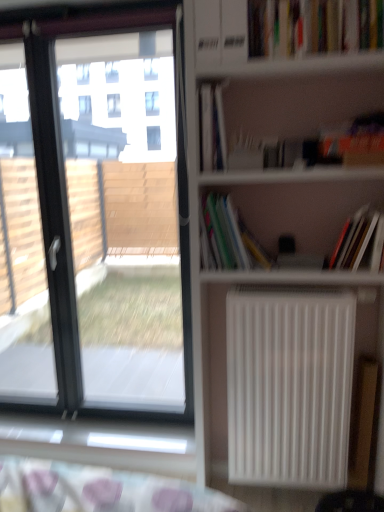
The image size is (384, 512). Describe the element at coordinates (95, 217) in the screenshot. I see `transparent glass window at left` at that location.

Describe the element at coordinates (354, 240) in the screenshot. I see `hardcover book at right, which appears as the fourth book when viewed from the top` at that location.

What do you see at coordinates (212, 128) in the screenshot? Image resolution: width=384 pixels, height=512 pixels. I see `hardcover book at upper center, marked as the 3th book in a bottom-to-top arrangement` at bounding box center [212, 128].

Where is `multicolored paper at center, which is the 3th book in top-to-bottom order`? multicolored paper at center, which is the 3th book in top-to-bottom order is located at coordinates (227, 237).

Find the location of `white matte radiator at center right`. white matte radiator at center right is located at coordinates (289, 386).

Where is `bookcase on the left of white matte radiator at center right`? bookcase on the left of white matte radiator at center right is located at coordinates (265, 272).

Which point is more distant from viewer, (353, 312) or (340, 85)?

Positioned behind is point (340, 85).

From a real-world perspective, which is physically above, white matte radiator at center right or white matte radiator at center?

In real-world perspective, white matte radiator at center is above.

Would you say white matte radiator at center right is outside white matte radiator at center?

No, most part of white matte radiator at center right lies within white matte radiator at center.

Based on their positions, is hardcover book at upper center, marked as the 3th book in a bottom-to-top arrangement, located to the left or right of multicolored paper at center, which is the 3th book in top-to-bottom order?

Clearly, hardcover book at upper center, marked as the 3th book in a bottom-to-top arrangement, is on the left of multicolored paper at center, which is the 3th book in top-to-bottom order, in the image.

Relative to multicolored paper at center, which is the 3th book in top-to-bottom order, is hardcover book at upper center, marked as the 3th book in a bottom-to-top arrangement, in front or behind?

Clearly, hardcover book at upper center, marked as the 3th book in a bottom-to-top arrangement, is in front of multicolored paper at center, which is the 3th book in top-to-bottom order.

Which of these two, hardcover book at upper center, marked as the 3th book in a bottom-to-top arrangement, or multicolored paper at center, which is the 2th book in bottom-to-top order, stands taller?

hardcover book at upper center, marked as the 3th book in a bottom-to-top arrangement.

Considering their positions, is multicolored paper at center, which is the 3th book in top-to-bottom order, located in front of or behind white matte radiator at center?

multicolored paper at center, which is the 3th book in top-to-bottom order, is behind white matte radiator at center.

Between multicolored paper at center, which is the 2th book in bottom-to-top order, and white matte radiator at center, which one appears on the left side from the viewer's perspective?

From the viewer's perspective, multicolored paper at center, which is the 2th book in bottom-to-top order, appears more on the left side.

From the image's perspective, which object appears higher, multicolored paper at center, which is the 2th book in bottom-to-top order, or white matte radiator at center?

multicolored paper at center, which is the 2th book in bottom-to-top order.

Is the surface of multicolored paper at center, which is the 3th book in top-to-bottom order, in direct contact with white matte radiator at center?

multicolored paper at center, which is the 3th book in top-to-bottom order, and white matte radiator at center are not in contact.

From the picture: Is transparent glass window at left positioned with its back to white matte radiator at center?

No, white matte radiator at center is not at the back of transparent glass window at left.

From a real-world perspective, which object stands above the other?

From a 3D spatial view, transparent glass window at left is above.

The height and width of the screenshot is (512, 384). Identify the location of window behind the white matte radiator at center. (95, 217).

Looking at their sizes, would you say transparent glass window at left is wider or thinner than white matte radiator at center?

Clearly, transparent glass window at left has less width compared to white matte radiator at center.

Measure the distance between white matte radiator at center and hardcover book at right, the first book in the bottom-to-top sequence.

The distance of white matte radiator at center from hardcover book at right, the first book in the bottom-to-top sequence, is 15.34 inches.

Which object is thinner, white matte radiator at center or hardcover book at right, which appears as the fourth book when viewed from the top?

hardcover book at right, which appears as the fourth book when viewed from the top, is thinner.

From the image's perspective, which object appears higher, white matte radiator at center or hardcover book at right, which appears as the fourth book when viewed from the top?

hardcover book at right, which appears as the fourth book when viewed from the top, from the image's perspective.

Is white matte radiator at center taller than hardcover book at right, the first book in the bottom-to-top sequence?

Indeed, white matte radiator at center has a greater height compared to hardcover book at right, the first book in the bottom-to-top sequence.

Between hardcover book at upper center, marked as the 3th book in a bottom-to-top arrangement, and hardcover book at upper right, the 4th book in the bottom-to-top sequence, which one appears on the left side from the viewer's perspective?

From the viewer's perspective, hardcover book at upper center, marked as the 3th book in a bottom-to-top arrangement, appears more on the left side.

How different are the orientations of hardcover book at upper center, marked as the 3th book in a bottom-to-top arrangement, and hardcover book at upper right, the 4th book in the bottom-to-top sequence, in degrees?

The facing directions of hardcover book at upper center, marked as the 3th book in a bottom-to-top arrangement, and hardcover book at upper right, the 4th book in the bottom-to-top sequence, are 0.977 degrees apart.

Who is shorter, hardcover book at upper center, which ranks as the second book in top-to-bottom order, or hardcover book at upper right, the 4th book in the bottom-to-top sequence?

With less height is hardcover book at upper right, the 4th book in the bottom-to-top sequence.

Is hardcover book at upper center, which ranks as the second book in top-to-bottom order, positioned with its back to hardcover book at upper right, the 4th book in the bottom-to-top sequence?

No, hardcover book at upper center, which ranks as the second book in top-to-bottom order, is not facing the opposite direction of hardcover book at upper right, the 4th book in the bottom-to-top sequence.

Which is more to the right, hardcover book at upper right, which is the 1th book from top to bottom, or transparent glass window at left?

From the viewer's perspective, hardcover book at upper right, which is the 1th book from top to bottom, appears more on the right side.

Is transparent glass window at left at the back of hardcover book at upper right, which is the 1th book from top to bottom?

No, hardcover book at upper right, which is the 1th book from top to bottom, is not facing the opposite direction of transparent glass window at left.

Is point (374, 10) more distant than point (159, 178)?

That is False.

Considering the relative sizes of hardcover book at upper right, which is the 1th book from top to bottom, and transparent glass window at left in the image provided, is hardcover book at upper right, which is the 1th book from top to bottom, bigger than transparent glass window at left?

No, hardcover book at upper right, which is the 1th book from top to bottom, is not bigger than transparent glass window at left.

You are a GUI agent. You are given a task and a screenshot of the screen. Output one action in this format:
    pyautogui.click(x=<x>, y=<y>)
    Task: Click on the radiator behind the white matte radiator at center
    Image resolution: width=384 pixels, height=512 pixels.
    Given the screenshot: What is the action you would take?
    [x=289, y=386]

Starting from the multicolored paper at center, which is the 2th book in bottom-to-top order, which book is the 1st one in front? Please provide its 2D coordinates.

[(212, 128)]

Based on their spatial positions, is hardcover book at right, which appears as the fourth book when viewed from the top, or hardcover book at upper center, marked as the 3th book in a bottom-to-top arrangement, further from transparent glass window at left?

Among the two, hardcover book at right, which appears as the fourth book when viewed from the top, is located further to transparent glass window at left.

When comparing their distances from hardcover book at upper right, which is the 1th book from top to bottom, does white matte radiator at center or white matte radiator at center right seem closer?

white matte radiator at center lies closer to hardcover book at upper right, which is the 1th book from top to bottom, than the other object.

Estimate the real-world distances between objects in this image. Which object is further from multicolored paper at center, which is the 2th book in bottom-to-top order, transparent glass window at left or white matte radiator at center?

Based on the image, transparent glass window at left appears to be further to multicolored paper at center, which is the 2th book in bottom-to-top order.

Which object lies further to the anchor point hardcover book at upper center, marked as the 3th book in a bottom-to-top arrangement, white matte radiator at center right or white matte radiator at center?

The object further to hardcover book at upper center, marked as the 3th book in a bottom-to-top arrangement, is white matte radiator at center right.

Which object lies nearer to the anchor point hardcover book at upper center, marked as the 3th book in a bottom-to-top arrangement, hardcover book at upper right, which is the 1th book from top to bottom, or hardcover book at right, which appears as the fourth book when viewed from the top?

hardcover book at upper right, which is the 1th book from top to bottom, lies closer to hardcover book at upper center, marked as the 3th book in a bottom-to-top arrangement, than the other object.

Looking at the image, which one is located further to white matte radiator at center right, hardcover book at right, the first book in the bottom-to-top sequence, or multicolored paper at center, which is the 2th book in bottom-to-top order?

hardcover book at right, the first book in the bottom-to-top sequence, lies further to white matte radiator at center right than the other object.

Which object lies nearer to the anchor point white matte radiator at center, multicolored paper at center, which is the 3th book in top-to-bottom order, or hardcover book at upper center, which ranks as the second book in top-to-bottom order?

multicolored paper at center, which is the 3th book in top-to-bottom order, is positioned closer to the anchor white matte radiator at center.

Considering their positions, is white matte radiator at center positioned further to hardcover book at right, which appears as the fourth book when viewed from the top, than multicolored paper at center, which is the 2th book in bottom-to-top order?

Based on the image, multicolored paper at center, which is the 2th book in bottom-to-top order, appears to be further to hardcover book at right, which appears as the fourth book when viewed from the top.

Find the location of a particular element. bookcase between transparent glass window at left and hardcover book at right, the first book in the bottom-to-top sequence, in the horizontal direction is located at coordinates (265, 272).

Locate an element on the screen. Image resolution: width=384 pixels, height=512 pixels. bookcase between hardcover book at upper right, which is the 1th book from top to bottom, and white matte radiator at center right, in the vertical direction is located at coordinates (265, 272).

You are a GUI agent. You are given a task and a screenshot of the screen. Output one action in this format:
    pyautogui.click(x=<x>, y=<y>)
    Task: Click on the bookcase located between transparent glass window at left and white matte radiator at center right in the left-right direction
    
    Given the screenshot: What is the action you would take?
    (265, 272)

Identify the location of bookcase located between multicolored paper at center, which is the 2th book in bottom-to-top order, and hardcover book at right, which appears as the fourth book when viewed from the top, in the left-right direction. The width and height of the screenshot is (384, 512). (265, 272).